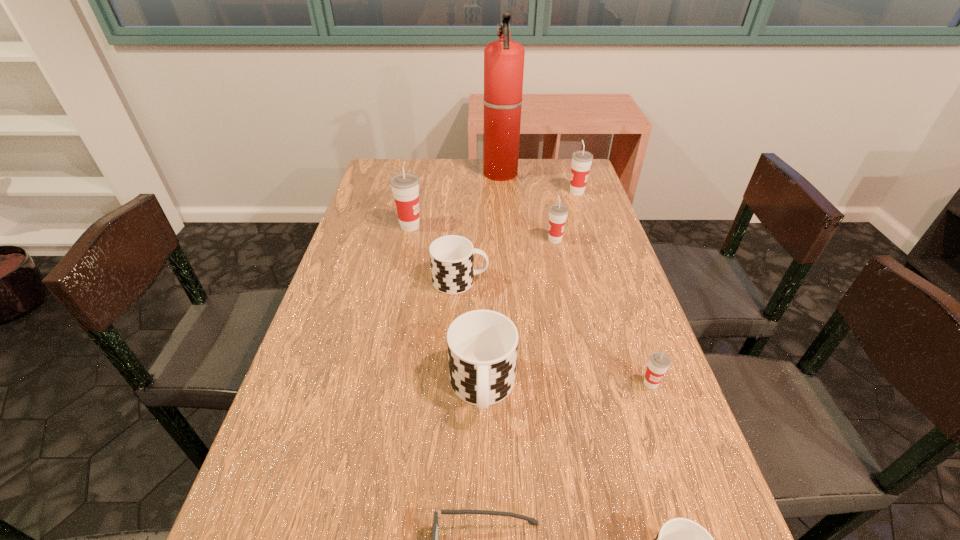
Locate an element on the screen. This screenshot has height=540, width=960. the fourth nearest cup is located at coordinates (452, 257).

The height and width of the screenshot is (540, 960). I want to click on the fifth nearest object, so click(452, 257).

Identify the location of free space located with the nozzle and gauge on the tallest object. The height and width of the screenshot is (540, 960). (396, 174).

Find the location of a particular element. This screenshot has height=540, width=960. free region located 0.330m with the nozzle and gauge on the tallest object is located at coordinates point(391,174).

This screenshot has height=540, width=960. I want to click on free space located 0.360m with the nozzle and gauge on the tallest object, so click(x=382, y=174).

Where is `vacant space located on the side of the biggest red cup with the logo`? Image resolution: width=960 pixels, height=540 pixels. vacant space located on the side of the biggest red cup with the logo is located at coordinates (507, 226).

The width and height of the screenshot is (960, 540). In order to click on vacant space located on the side of the seventh shortest object with the logo in this screenshot , I will do `click(474, 192)`.

What are the coordinates of `vacant position located 0.350m on the side of the seventh shortest object with the logo` in the screenshot? It's located at (463, 192).

Where is `vacant space located 0.200m on the side of the seventh shortest object with the logo`? Image resolution: width=960 pixels, height=540 pixels. vacant space located 0.200m on the side of the seventh shortest object with the logo is located at coordinates 507,192.

Locate an element on the screen. The image size is (960, 540). vacant space located 0.150m on the side of the fourth object from right to left with the logo is located at coordinates (493, 240).